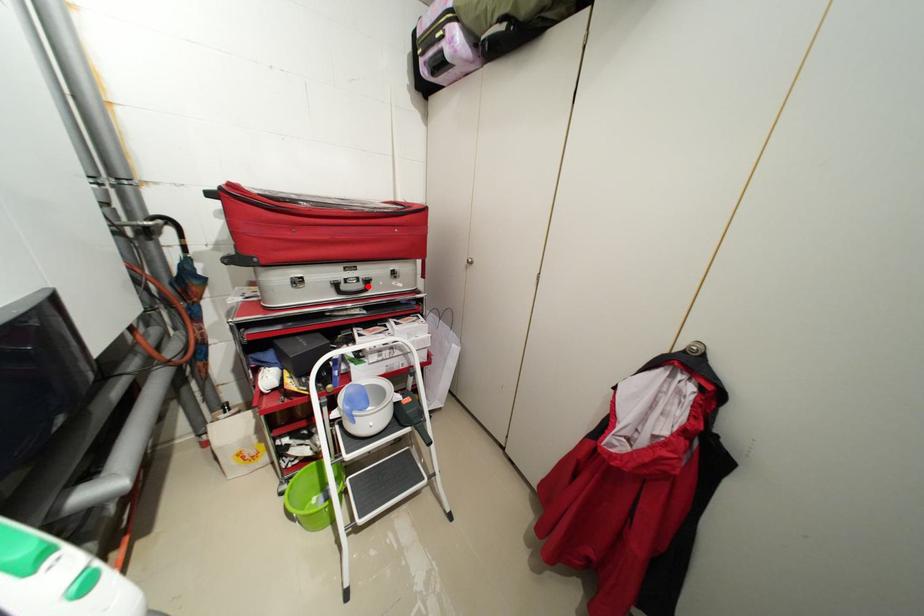
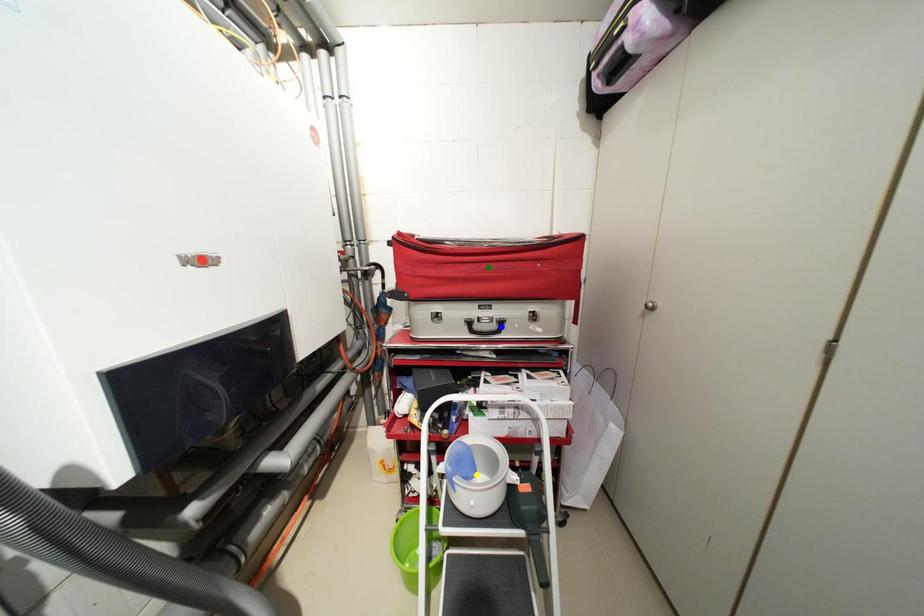
Question: I am providing you with two images of the same scene from different viewpoints. A red point is marked on the first image. You are given multiple points on the second image. In image 2, which mark is for the same physical point as the one in image 1?

Choices:
 (A) green point
 (B) yellow point
 (C) blue point

Answer: (C)